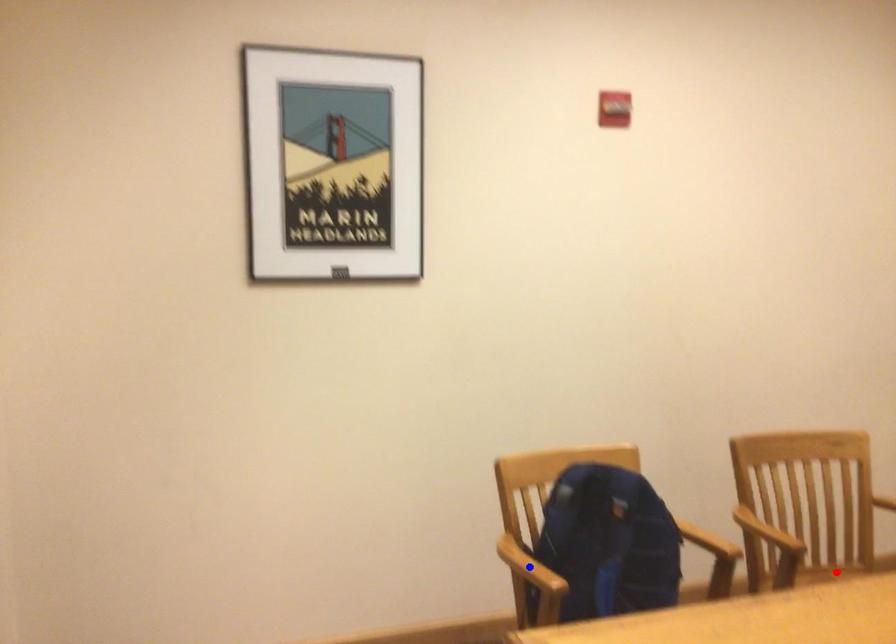
Question: In the image, two points are highlighted. Which point is nearer to the camera? Reply with the corresponding letter.

Choices:
 (A) blue point
 (B) red point

Answer: (A)